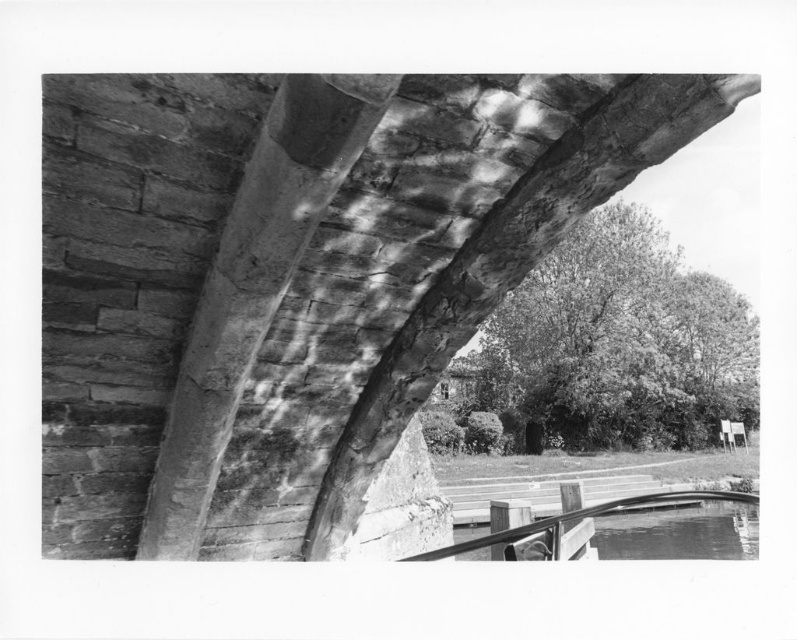
Can you confirm if stone textured bridge at upper center is positioned below rough stone beam at center?

Correct, stone textured bridge at upper center is located below rough stone beam at center.

Is point (481, 275) positioned in front of point (171, 412)?

Yes, point (481, 275) is in front of point (171, 412).

Who is more forward, (97,346) or (289,221)?

Point (289,221)

Locate an element on the screen. The height and width of the screenshot is (640, 797). stone textured bridge at upper center is located at coordinates (296, 282).